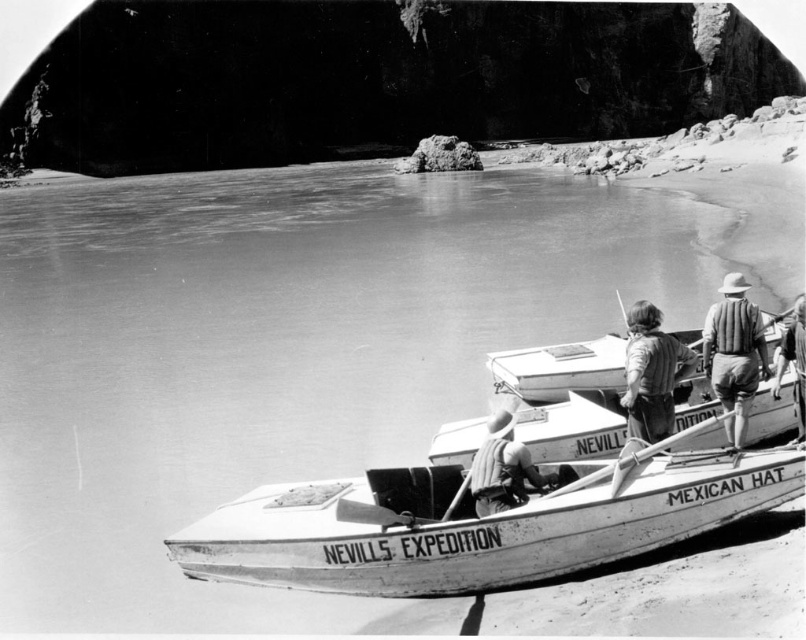
Consider the image. You are planning to carry the light brown wooden oar at right into the white wood boat at center. Can the oar fit inside the boat based on their sizes?

The white wood boat at center is wider than the light brown wooden oar at right, so the oar can fit inside the boat.

You are a photographer standing at the riverbank. You want to take a photo of the white wood boat at center and the smooth brown shirt at center. Which object is wider in the image?

The white wood boat at center is wider than the smooth brown shirt at center according to the description.

You are a photographer standing on the riverbank and want to take a picture of the white wood boat at center and the smooth brown shirt at center. Which object should you focus on first if you want to capture both in focus?

The white wood boat at center is much taller than the smooth brown shirt at center, so you should focus on the white wood boat at center first to ensure both are in focus.